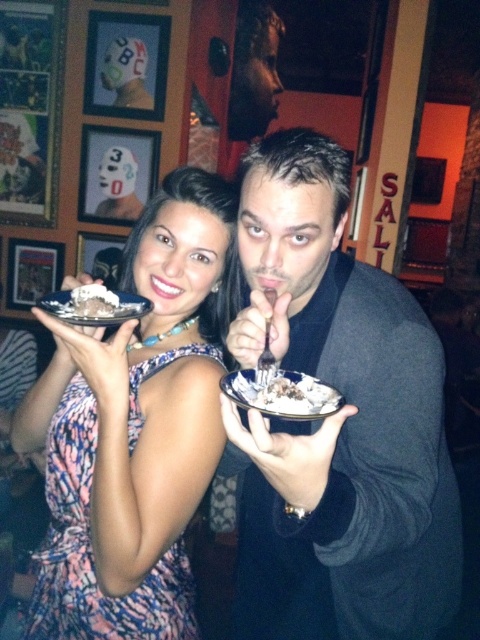
Can you confirm if white creamy dessert at center is positioned below chocolate cake at center?

Yes, white creamy dessert at center is below chocolate cake at center.

The image size is (480, 640). Find the location of `white creamy dessert at center`. white creamy dessert at center is located at coordinates (294, 396).

The image size is (480, 640). What are the coordinates of `white creamy dessert at center` in the screenshot? It's located at (x=294, y=396).

In the scene shown: Does white ceramic plate at center have a greater width compared to silver metallic plate at left?

Incorrect, white ceramic plate at center's width does not surpass silver metallic plate at left's.

Is point (334, 401) farther from viewer compared to point (67, 296)?

That is False.

This screenshot has width=480, height=640. Find the location of `white ceramic plate at center`. white ceramic plate at center is located at coordinates (283, 394).

Is matte black jacket at center thinner than white creamy dessert at center?

Incorrect, matte black jacket at center's width is not less than white creamy dessert at center's.

Does matte black jacket at center appear under white creamy dessert at center?

Yes.

Who is more distant from viewer, (400,349) or (284,381)?

Positioned behind is point (400,349).

Identify the location of matte black jacket at center. This screenshot has height=640, width=480. (336, 422).